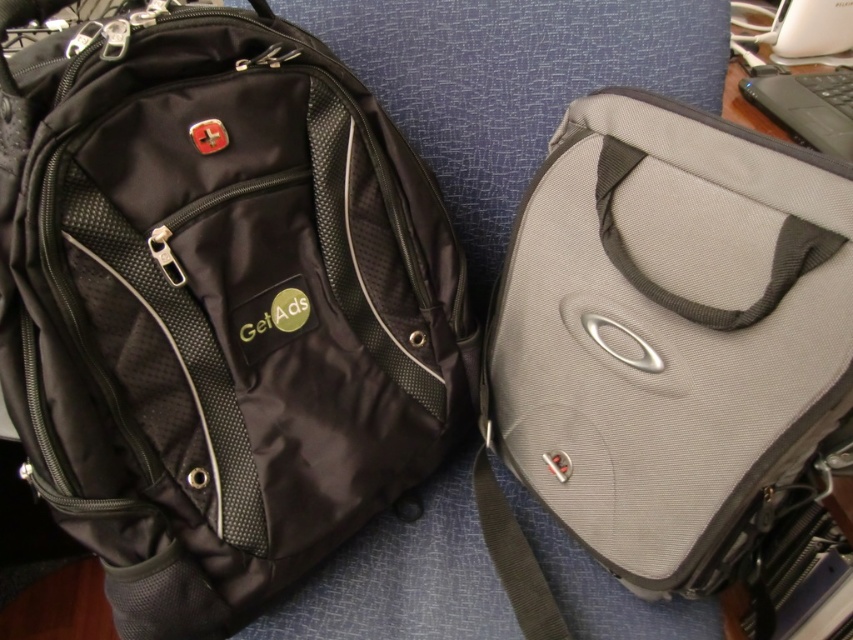
You are organizing a hiking trip and have both the matte black backpack at left and the black matte laptop at upper right. Which bag should you choose if you need more storage space for your gear?

The matte black backpack at left is bigger than the black matte laptop at upper right, so you should choose the matte black backpack at left for more storage space.

You are standing 1 meter away from the bags. Can you reach the point at coordinates point (531, 454) without moving closer?

The distance of point (531, 454) from camera is 89.49 centimeters. Since you are standing 1 meter away, which is 100 centimeters, you can reach the point at coordinates point (531, 454) without moving closer because it is within your reach distance.